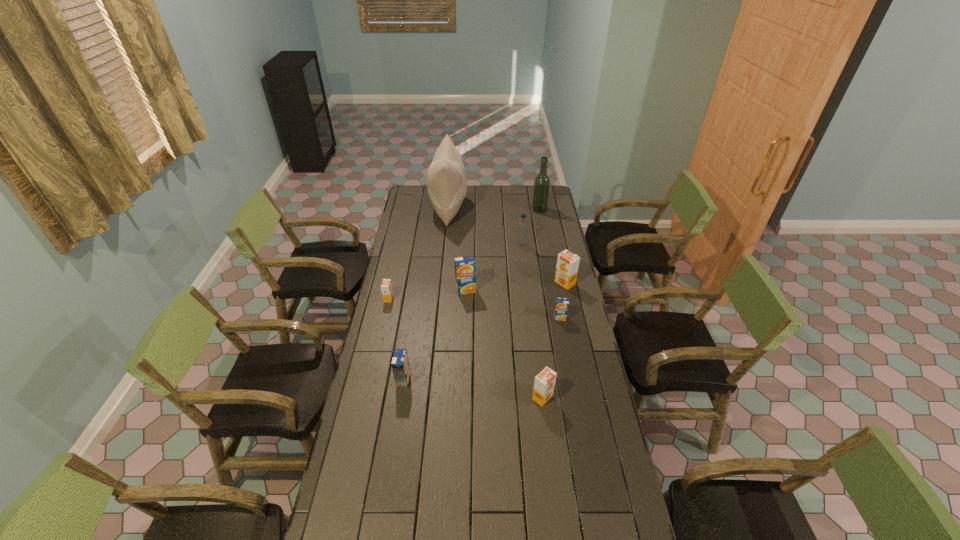
Where is `cushion`? This screenshot has width=960, height=540. cushion is located at coordinates (x=446, y=179).

Where is `green liquor`? green liquor is located at coordinates (542, 181).

Identify the location of blue water bottle. (522, 226).

The image size is (960, 540). Identify the location of the seventh nearest object. (522, 226).

This screenshot has width=960, height=540. I want to click on the farthest blue orange_juice, so click(465, 267).

Locate an element on the screen. This screenshot has width=960, height=540. the biggest blue orange_juice is located at coordinates (465, 267).

Find the location of a particular element. the biggest orange orange juice is located at coordinates (567, 266).

What are the coordinates of `the rightmost orange orange juice` in the screenshot? It's located at (567, 266).

The width and height of the screenshot is (960, 540). I want to click on the nearest object, so coord(544,383).

Locate an element on the screen. the third orange_juice from right to left is located at coordinates (544, 383).